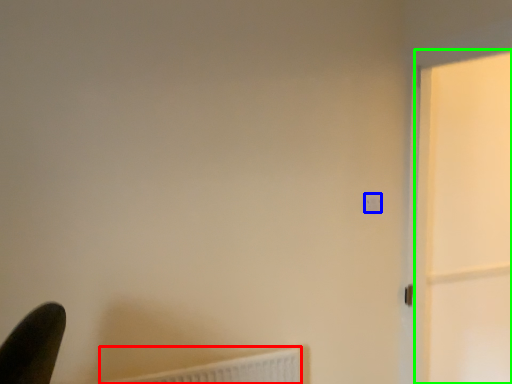
Question: Estimate the real-world distances between objects in this image. Which object is farther from radiator (highlighted by a red box), light switch (highlighted by a blue box) or screen door (highlighted by a green box)?

Choices:
 (A) light switch
 (B) screen door

Answer: (B)